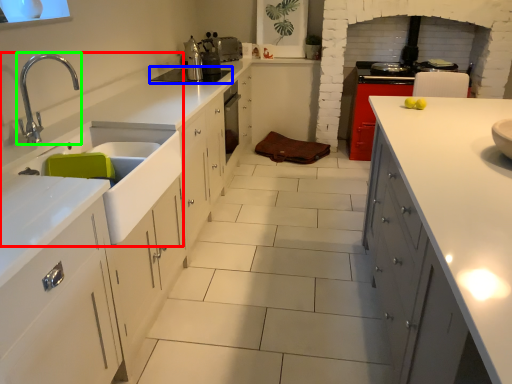
Question: Which object is the closest to the sink (highlighted by a red box)? Choose among these: home appliance (highlighted by a blue box) or tap (highlighted by a green box).

Choices:
 (A) home appliance
 (B) tap

Answer: (B)